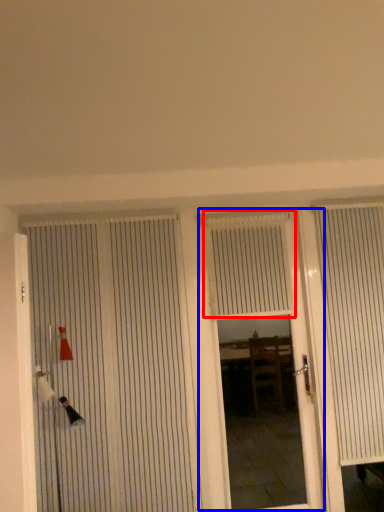
Question: Which of the following is the farthest to the observer, blind (highlighted by a red box) or door (highlighted by a blue box)?

Choices:
 (A) blind
 (B) door

Answer: (A)